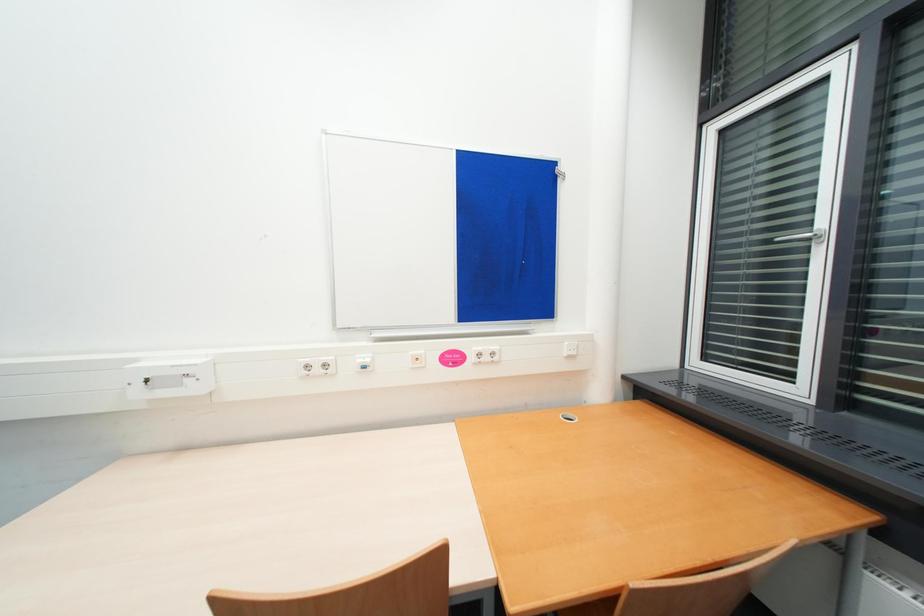
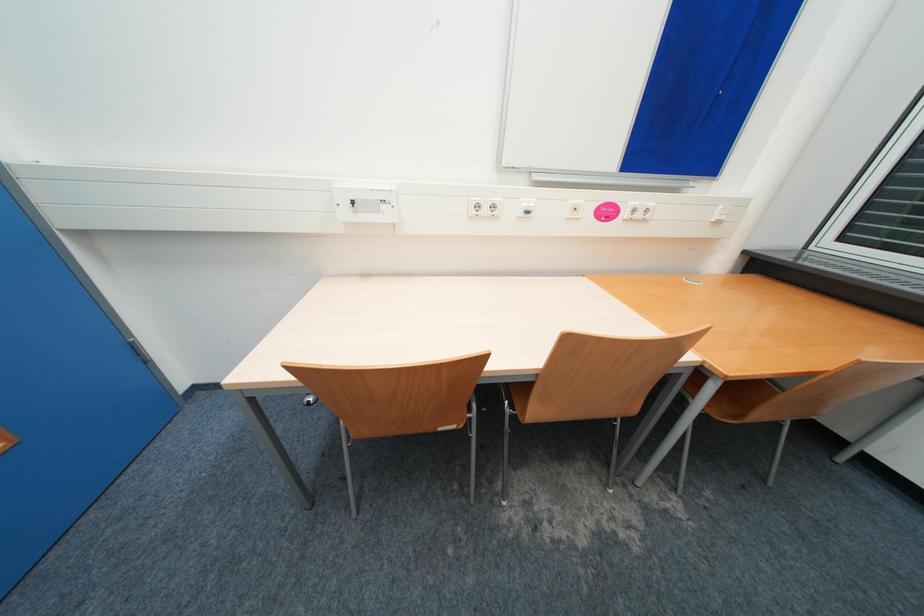
Question: Which direction would the cameraman need to move to produce the second image? Reply with the corresponding letter.

Choices:
 (A) Left
 (B) Right
 (C) Forward
 (D) Backward

Answer: (A)